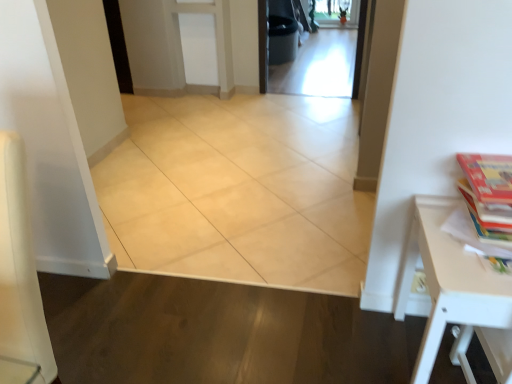
The width and height of the screenshot is (512, 384). Find the location of `vacant area on top of transparent glass screen door at center (from a real-world perspective)`. vacant area on top of transparent glass screen door at center (from a real-world perspective) is located at coordinates (305, 53).